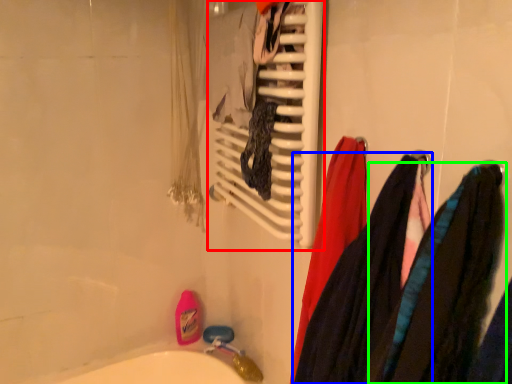
Question: Estimate the real-world distances between objects in this image. Which object is closer to towel rack (highlighted by a red box), clothing (highlighted by a blue box) or clothing (highlighted by a green box)?

Choices:
 (A) clothing
 (B) clothing

Answer: (A)